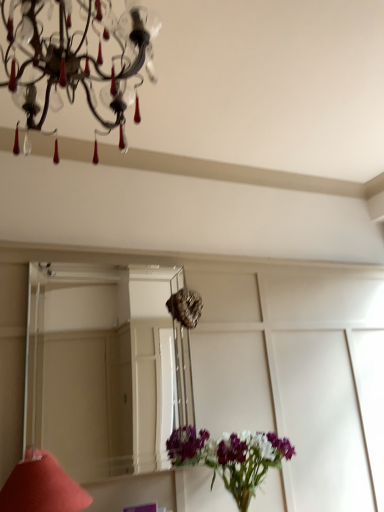
The image size is (384, 512). I want to click on matte red cone at lower left, so click(x=42, y=487).

Measure the distance between clear glass mirror at center and camera.

clear glass mirror at center and camera are 12.85 feet apart.

I want to click on crystal glass chandelier at upper left, so tap(78, 60).

Relative to crystal glass chandelier at upper left, is matte red cone at lower left in front or behind?

Clearly, matte red cone at lower left is behind crystal glass chandelier at upper left.

Considering the points (12, 488) and (55, 152), which point is in front, point (12, 488) or point (55, 152)?

The point (55, 152) is more forward.

Between matte red cone at lower left and crystal glass chandelier at upper left, which one appears on the left side from the viewer's perspective?

From the viewer's perspective, matte red cone at lower left appears more on the left side.

Is crystal glass chandelier at upper left wider or thinner than matte red cone at lower left?

In the image, crystal glass chandelier at upper left appears to be wider than matte red cone at lower left.

Does point (28, 101) come farther from viewer compared to point (68, 508)?

No, (28, 101) is in front of (68, 508).

Are crystal glass chandelier at upper left and matte red cone at lower left located far from each other?

Yes, crystal glass chandelier at upper left and matte red cone at lower left are quite far apart.

Which of these two, crystal glass chandelier at upper left or matte red cone at lower left, is smaller?

Smaller between the two is matte red cone at lower left.

Which is further, (79, 486) or (52, 390)?

The point (52, 390) is more distant.

Consider the image. Who is taller, matte red cone at lower left or clear glass mirror at center?

clear glass mirror at center is taller.

Considering the relative positions of matte red cone at lower left and clear glass mirror at center in the image provided, is matte red cone at lower left to the right of clear glass mirror at center from the viewer's perspective?

Incorrect, matte red cone at lower left is not on the right side of clear glass mirror at center.

Is matte red cone at lower left smaller than clear glass mirror at center?

Correct, matte red cone at lower left occupies less space than clear glass mirror at center.

Considering the relative sizes of clear glass mirror at center and matte red cone at lower left in the image provided, is clear glass mirror at center shorter than matte red cone at lower left?

Incorrect, the height of clear glass mirror at center does not fall short of that of matte red cone at lower left.

From a real-world perspective, does clear glass mirror at center stand above matte red cone at lower left?

Correct, in the physical world, clear glass mirror at center is higher than matte red cone at lower left.

Is clear glass mirror at center positioned in front of matte red cone at lower left?

No, clear glass mirror at center is behind matte red cone at lower left.

In order to click on mirror above the matte red cone at lower left (from the image's perspective) in this screenshot , I will do `click(101, 370)`.

From a real-world perspective, who is located higher, crystal glass chandelier at upper left or clear glass mirror at center?

crystal glass chandelier at upper left is physically above.

Is crystal glass chandelier at upper left located outside clear glass mirror at center?

crystal glass chandelier at upper left lies outside clear glass mirror at center's area.

Image resolution: width=384 pixels, height=512 pixels. Identify the location of lamp located in front of the clear glass mirror at center. (78, 60).

From the picture: Does crystal glass chandelier at upper left appear on the left side of clear glass mirror at center?

In fact, crystal glass chandelier at upper left is to the right of clear glass mirror at center.

Based on the photo, is clear glass mirror at center at the right side of crystal glass chandelier at upper left?

In fact, clear glass mirror at center is to the left of crystal glass chandelier at upper left.

Where is `lamp that appears above the clear glass mirror at center (from a real-world perspective)`? lamp that appears above the clear glass mirror at center (from a real-world perspective) is located at coordinates (78, 60).

From a real-world perspective, is clear glass mirror at center positioned over crystal glass chandelier at upper left based on gravity?

No, from a real-world perspective, clear glass mirror at center is not above crystal glass chandelier at upper left.

Find the location of a particular element. The width and height of the screenshot is (384, 512). lamp in front of the matte red cone at lower left is located at coordinates (78, 60).

This screenshot has width=384, height=512. I want to click on lamp that appears above the matte red cone at lower left (from a real-world perspective), so click(x=78, y=60).

Looking at the image, which one is located further to matte red cone at lower left, crystal glass chandelier at upper left or clear glass mirror at center?

clear glass mirror at center lies further to matte red cone at lower left than the other object.

From the image, which object appears to be farther from clear glass mirror at center, matte red cone at lower left or crystal glass chandelier at upper left?

Among the two, crystal glass chandelier at upper left is located further to clear glass mirror at center.

Considering their positions, is clear glass mirror at center positioned further to crystal glass chandelier at upper left than matte red cone at lower left?

The object further to crystal glass chandelier at upper left is clear glass mirror at center.

From the image, which object appears to be nearer to clear glass mirror at center, crystal glass chandelier at upper left or matte red cone at lower left?

matte red cone at lower left lies closer to clear glass mirror at center than the other object.

Based on their spatial positions, is matte red cone at lower left or clear glass mirror at center further from crystal glass chandelier at upper left?

The object further to crystal glass chandelier at upper left is clear glass mirror at center.

Based on the photo, estimate the real-world distances between objects in this image. Which object is further from matte red cone at lower left, clear glass mirror at center or crystal glass chandelier at upper left?

Among the two, clear glass mirror at center is located further to matte red cone at lower left.

At what (x,y) coordinates should I click in order to perform the action: click on mirror between crystal glass chandelier at upper left and matte red cone at lower left in the up-down direction. Please return your answer as a coordinate pair (x, y). Looking at the image, I should click on (101, 370).